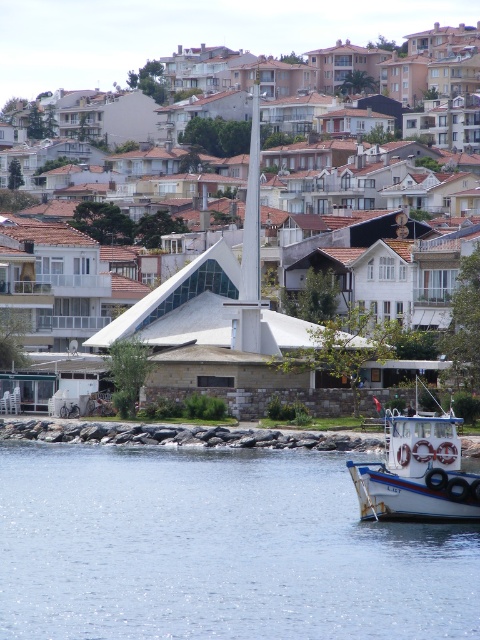
Is point (183, 452) positioned after point (380, 470)?

Yes.

Who is positioned more to the left, clear water at lower left or white plastic boat at lower right?

clear water at lower left is more to the left.

Locate an element on the screen. The width and height of the screenshot is (480, 640). clear water at lower left is located at coordinates (216, 548).

In order to click on clear water at lower left in this screenshot , I will do `click(216, 548)`.